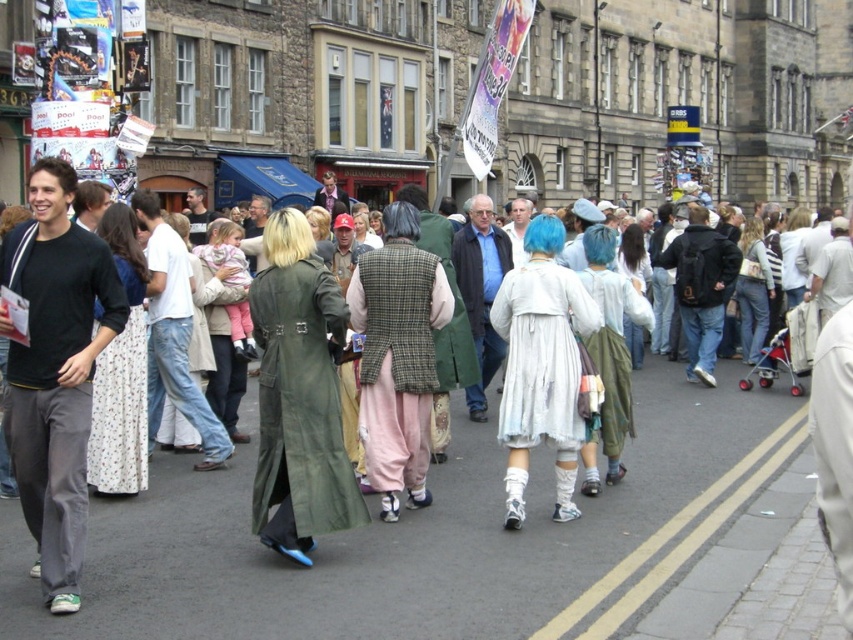
Question: Does matte green coat at center have a smaller size compared to blue plaid vest at center?

Choices:
 (A) no
 (B) yes

Answer: (A)

Question: Which point is farther from the camera taking this photo?

Choices:
 (A) (38, 308)
 (B) (706, 237)

Answer: (B)

Question: Is green matte coat at center wider than white textured dress at center?

Choices:
 (A) yes
 (B) no

Answer: (A)

Question: Which object appears closest to the camera in this image?

Choices:
 (A) white textured dress at center
 (B) black backpack at center
 (C) blue plaid vest at center
 (D) green matte coat at center

Answer: (D)

Question: Considering the real-world distances, which object is closest to the dark gray cotton pants at left?

Choices:
 (A) green matte coat at center
 (B) white textured dress at center
 (C) light blue denim jeans at center

Answer: (A)

Question: Can you confirm if dark gray cotton pants at left is positioned to the left of blue plaid vest at center?

Choices:
 (A) no
 (B) yes

Answer: (B)